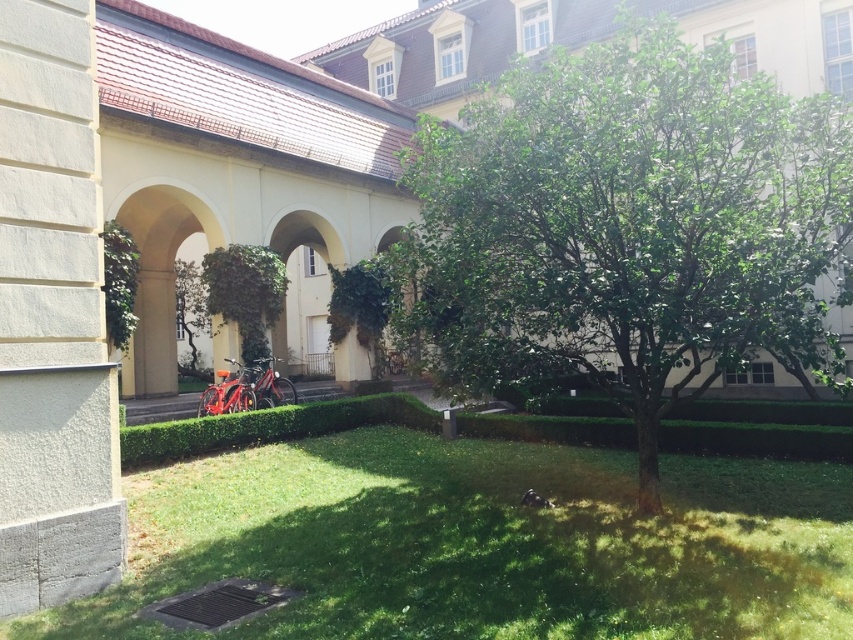
You are a landscape architect designing a new courtyard. You have a requirement to place a 4.5 meter wide statue between the green grass at lower center and the green leafy hedge at center. Is there enough space for the statue?

The green grass at lower center and the green leafy hedge at center are 5.07 meters apart, so yes, the 4.5 meter wide statue can fit between them since the distance is sufficient.

You are standing in the courtyard and want to take a photo of both the green leafy tree at center and the green leafy hedge at center. Which object should you focus on first to ensure both are in the frame?

You should focus on the green leafy tree at center first because it is closer to you than the green leafy hedge at center, allowing both to be in the frame when properly focused.

Looking at this image, you are standing in the courtyard and want to walk to the tree in the center. Do you need to go around the green leafy hedge at center to reach the green grass at lower center where the tree is?

The green grass at lower center is positioned under the green leafy hedge at center, so you can walk directly to the green grass at lower center without needing to go around the hedge since it is located beneath it.